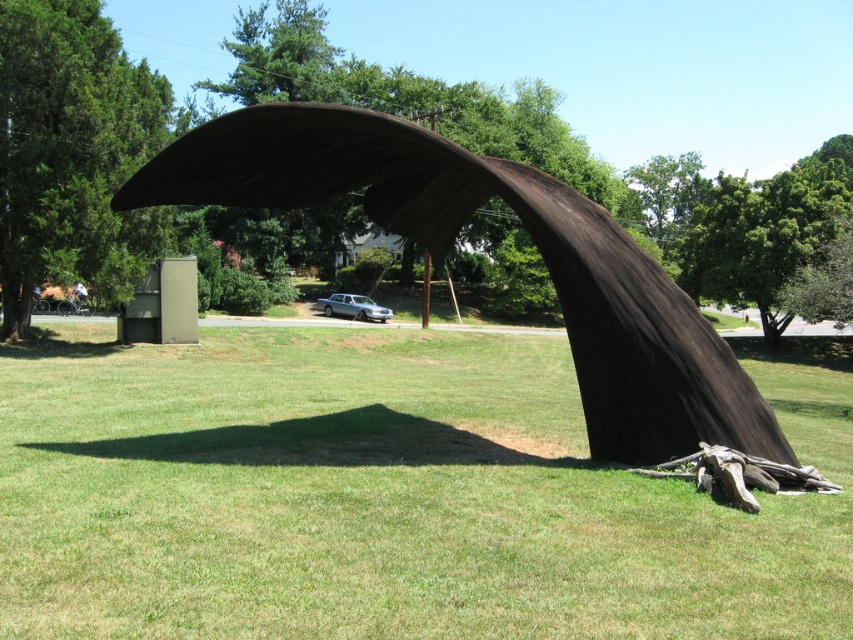
Question: Does green grass at center appear on the right side of black wood sculpture at center?

Choices:
 (A) no
 (B) yes

Answer: (B)

Question: Which of the following is the closest to the observer?

Choices:
 (A) black wood sculpture at center
 (B) green leafy tree at left
 (C) green grass at center

Answer: (C)

Question: Does black wood sculpture at center appear over green leafy tree at left?

Choices:
 (A) yes
 (B) no

Answer: (B)

Question: Which point is farther from the camera taking this photo?

Choices:
 (A) (33, 189)
 (B) (776, 454)
 (C) (235, 573)

Answer: (A)

Question: Does green grass at center appear on the right side of green leafy tree at left?

Choices:
 (A) yes
 (B) no

Answer: (A)

Question: Considering the real-world distances, which object is closest to the black wood sculpture at center?

Choices:
 (A) green grass at center
 (B) green leafy tree at left

Answer: (A)